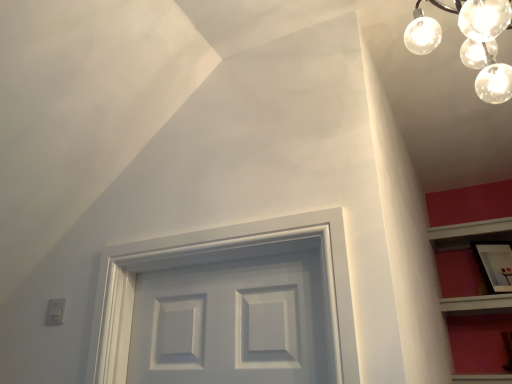
What are the coordinates of `clear glass globe at upper right` in the screenshot? It's located at (487, 45).

Describe the element at coordinates (487, 45) in the screenshot. Image resolution: width=512 pixels, height=384 pixels. I see `clear glass globe at upper right` at that location.

What do you see at coordinates (495, 264) in the screenshot? This screenshot has width=512, height=384. I see `matte black picture frame at upper right` at bounding box center [495, 264].

This screenshot has height=384, width=512. Identify the location of matte black picture frame at upper right. (495, 264).

Identify the location of clear glass globe at upper right. (487, 45).

Considering the relative positions of clear glass globe at upper right and matte black picture frame at upper right in the image provided, is clear glass globe at upper right to the left of matte black picture frame at upper right from the viewer's perspective?

Yes.

Relative to matte black picture frame at upper right, is clear glass globe at upper right in front or behind?

Visually, clear glass globe at upper right is located in front of matte black picture frame at upper right.

Which point is more forward, (418, 40) or (493, 247)?

The point (418, 40) is closer to the camera.

From the image's perspective, is clear glass globe at upper right located beneath matte black picture frame at upper right?

Actually, clear glass globe at upper right appears above matte black picture frame at upper right in the image.

From a real-world perspective, is clear glass globe at upper right under matte black picture frame at upper right?

Actually, clear glass globe at upper right is physically above matte black picture frame at upper right in the real world.

Is clear glass globe at upper right wider or thinner than matte black picture frame at upper right?

Clearly, clear glass globe at upper right has more width compared to matte black picture frame at upper right.

Looking at this image, between clear glass globe at upper right and matte black picture frame at upper right, which one has less height?

matte black picture frame at upper right is shorter.

Considering the relative sizes of clear glass globe at upper right and matte black picture frame at upper right in the image provided, is clear glass globe at upper right smaller than matte black picture frame at upper right?

No, clear glass globe at upper right is not smaller than matte black picture frame at upper right.

Is clear glass globe at upper right situated inside matte black picture frame at upper right or outside?

clear glass globe at upper right is not inside matte black picture frame at upper right, it's outside.

Is clear glass globe at upper right next to matte black picture frame at upper right and touching it?

No, clear glass globe at upper right is not next to matte black picture frame at upper right.

Is clear glass globe at upper right turned away from matte black picture frame at upper right?

Correct, clear glass globe at upper right is looking away from matte black picture frame at upper right.

There is a matte black picture frame at upper right. Where is `light fixture above it (from a real-world perspective)`? Image resolution: width=512 pixels, height=384 pixels. light fixture above it (from a real-world perspective) is located at coordinates (487, 45).

Between matte black picture frame at upper right and clear glass globe at upper right, which one appears on the left side from the viewer's perspective?

Positioned to the left is clear glass globe at upper right.

Between matte black picture frame at upper right and clear glass globe at upper right, which one is positioned behind?

Positioned behind is matte black picture frame at upper right.

Between point (501, 263) and point (462, 16), which one is positioned in front?

The point (462, 16) is closer to the camera.

From the image's perspective, is matte black picture frame at upper right positioned above or below clear glass globe at upper right?

From the image's perspective, matte black picture frame at upper right appears below clear glass globe at upper right.

From a real-world perspective, who is located lower, matte black picture frame at upper right or clear glass globe at upper right?

In real-world perspective, matte black picture frame at upper right is lower.

Considering the relative sizes of matte black picture frame at upper right and clear glass globe at upper right in the image provided, is matte black picture frame at upper right thinner than clear glass globe at upper right?

Correct, the width of matte black picture frame at upper right is less than that of clear glass globe at upper right.

Considering the relative sizes of matte black picture frame at upper right and clear glass globe at upper right in the image provided, is matte black picture frame at upper right shorter than clear glass globe at upper right?

Indeed, matte black picture frame at upper right has a lesser height compared to clear glass globe at upper right.

Can you confirm if matte black picture frame at upper right is smaller than clear glass globe at upper right?

Indeed, matte black picture frame at upper right has a smaller size compared to clear glass globe at upper right.

Would you say matte black picture frame at upper right contains clear glass globe at upper right?

No, matte black picture frame at upper right does not contain clear glass globe at upper right.

Is matte black picture frame at upper right far from clear glass globe at upper right?

Yes, matte black picture frame at upper right and clear glass globe at upper right are located far from each other.

Is matte black picture frame at upper right aimed at clear glass globe at upper right?

No, matte black picture frame at upper right is not oriented towards clear glass globe at upper right.

Can you tell me how much matte black picture frame at upper right and clear glass globe at upper right differ in facing direction?

32.6 degrees separate the facing orientations of matte black picture frame at upper right and clear glass globe at upper right.

This screenshot has height=384, width=512. I want to click on light fixture located above the matte black picture frame at upper right (from a real-world perspective), so click(487, 45).

This screenshot has height=384, width=512. Find the location of `picture frame beneath the clear glass globe at upper right (from a real-world perspective)`. picture frame beneath the clear glass globe at upper right (from a real-world perspective) is located at coordinates click(x=495, y=264).

Find the location of `light fixture on the left of matte black picture frame at upper right`. light fixture on the left of matte black picture frame at upper right is located at coordinates (487, 45).